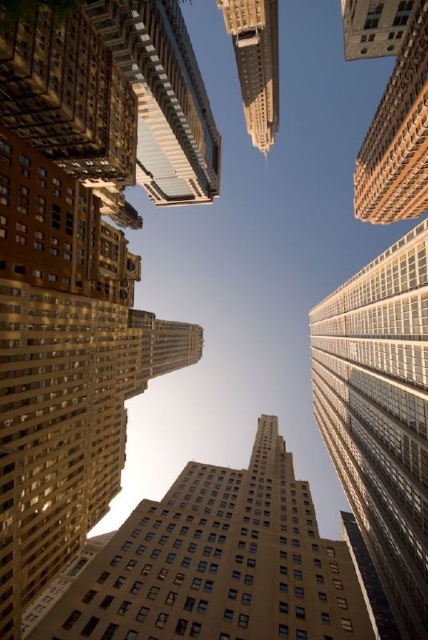
You are a drone operator trying to navigate between the glassy reflective skyscraper at center and the gold textured building at upper center. Which building should you fly closer to first to avoid obstacles?

You should fly closer to the glassy reflective skyscraper at center first because it is in front of the gold textured building at upper center, so it is closer to you.

Looking at this image, you are standing at the base of the city looking up. You want to take a photo of the gold glass skyscraper at upper right without the glassy reflective skyscraper at center blocking it. Is this possible from your current position?

The glassy reflective skyscraper at center is closer to the viewer than the gold glass skyscraper at upper right, so it will block the view of the gold glass skyscraper at upper right from your current position.

You are a drone operator tasked with flying a drone between the golden glass skyscraper at center and the glassy reflective skyscraper at center. The drone has a maximum flight distance of 100 feet. Based on the scene, can the drone safely complete this task without exceeding its range?

The distance between the golden glass skyscraper at center and the glassy reflective skyscraper at center is 119.24 feet, which exceeds the drone operator has a maximum flight distance of 100 feet. Therefore, the drone cannot safely complete the task without exceeding its range.